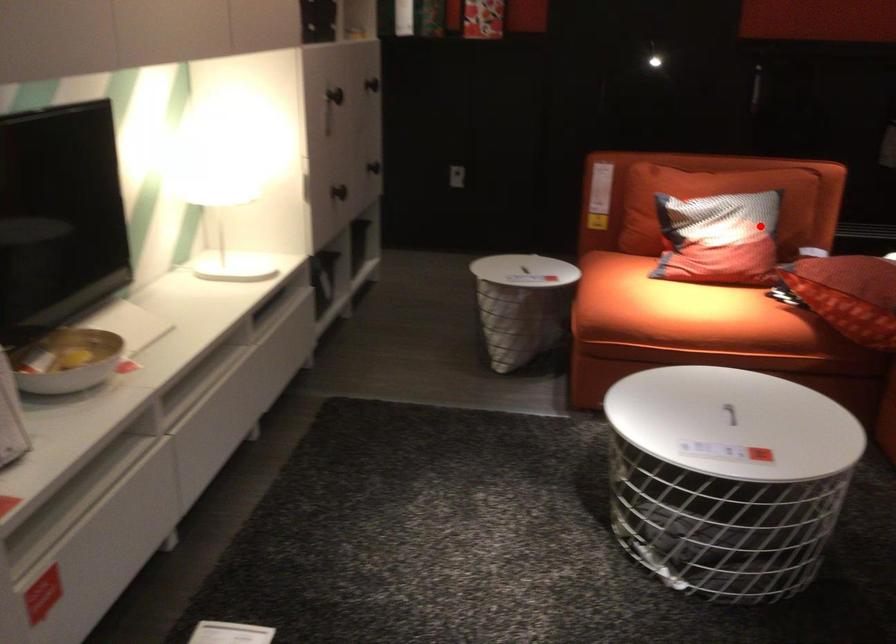
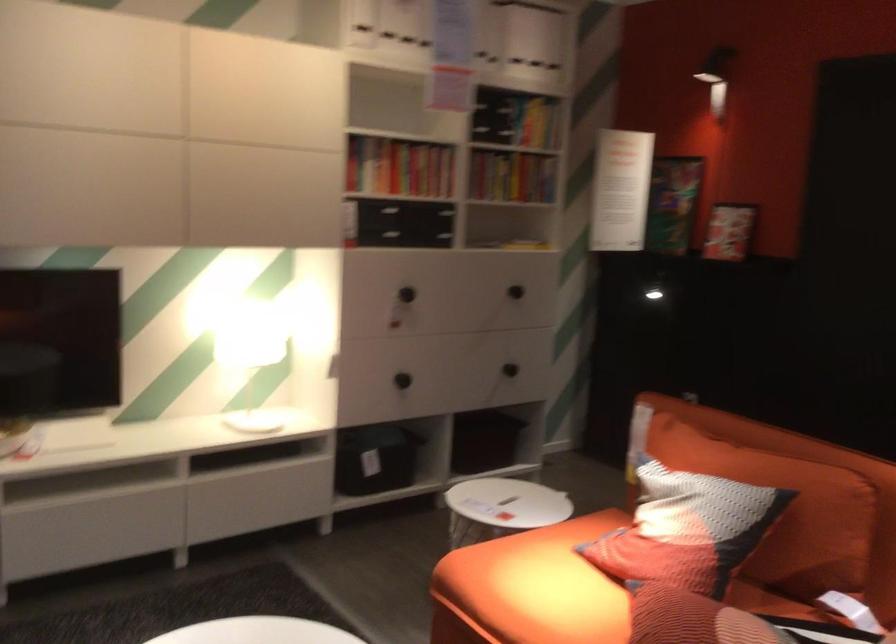
Where in the second image is the point corresponding to the highlighted location from the first image?

(686, 529)